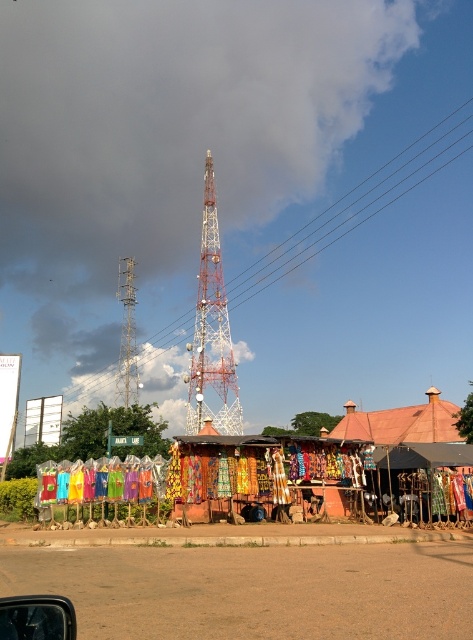
Question: Is metallic red tower at center positioned behind terracotta clay hut at lower right?

Choices:
 (A) yes
 (B) no

Answer: (A)

Question: Among these points, which one is nearest to the camera?

Choices:
 (A) (43, 602)
 (B) (120, 292)

Answer: (A)

Question: Does terracotta clay hut at lower right have a lesser width compared to transparent glass car window at lower left?

Choices:
 (A) no
 (B) yes

Answer: (A)

Question: Based on their relative distances, which object is farther from the metallic red tower at center?

Choices:
 (A) metallic silver tower at left
 (B) terracotta clay hut at lower right

Answer: (B)

Question: Which point appears farthest from the camera in this image?

Choices:
 (A) (35, 628)
 (B) (131, 401)
 (C) (227, 417)
 (D) (359, 428)

Answer: (B)

Question: Is metallic red tower at center positioned behind transparent glass car window at lower left?

Choices:
 (A) no
 (B) yes

Answer: (B)